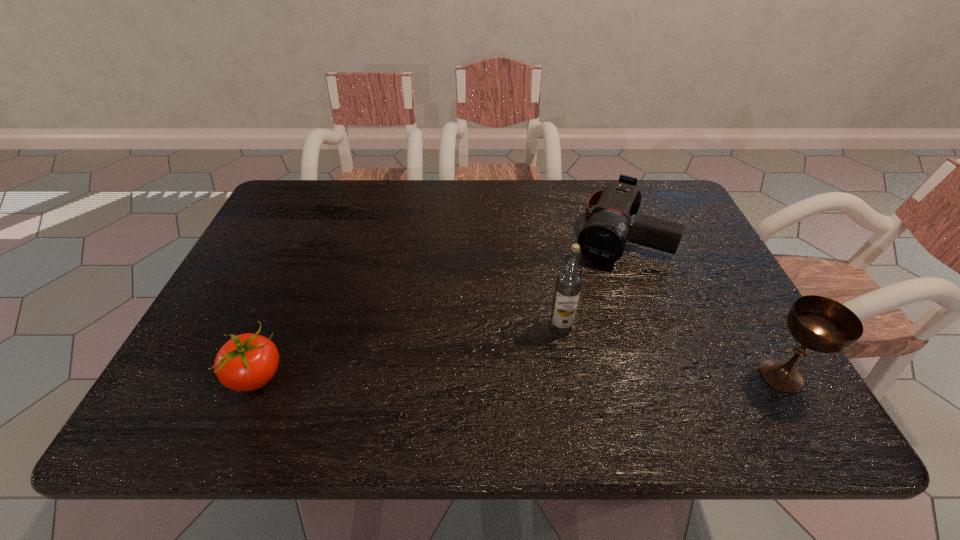
Locate an element on the screen. Image resolution: width=960 pixels, height=540 pixels. vacant spot on the desktop that is between the tomato and the second tallest object and is positioned on the lens of the camcorder is located at coordinates (549, 376).

Locate an element on the screen. The height and width of the screenshot is (540, 960). free space on the desktop that is between the leftmost object and the second tallest object and is positioned on the label of the second object from left to right is located at coordinates (492, 376).